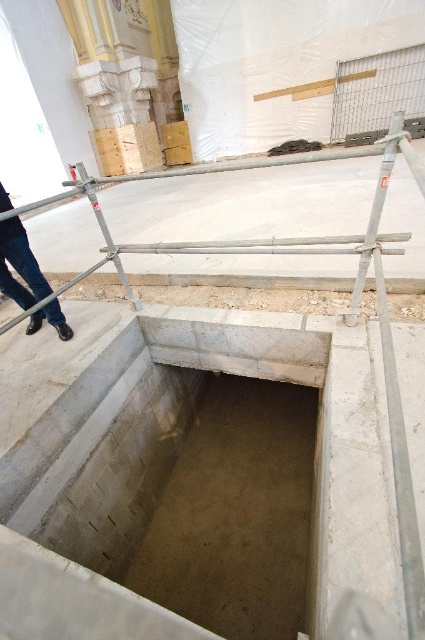
Can you confirm if metal scaffolding at center is shorter than blue jeans at left?

Incorrect, metal scaffolding at center's height does not fall short of blue jeans at left's.

Who is more distant from viewer, (391, 118) or (16, 291)?

The point (391, 118) is behind.

At what (x,y) coordinates should I click in order to perform the action: click on metal scaffolding at center. Please return your answer as a coordinate pair (x, y). Looking at the image, I should click on (255, 237).